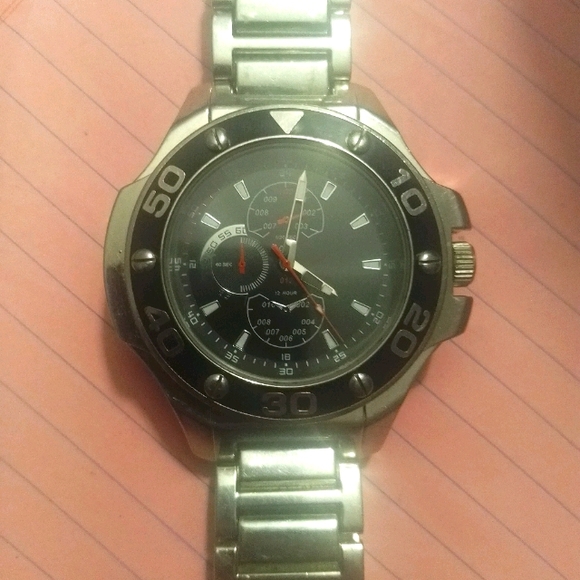
Locate an element on the screen. grooved knob is located at coordinates (463, 261).